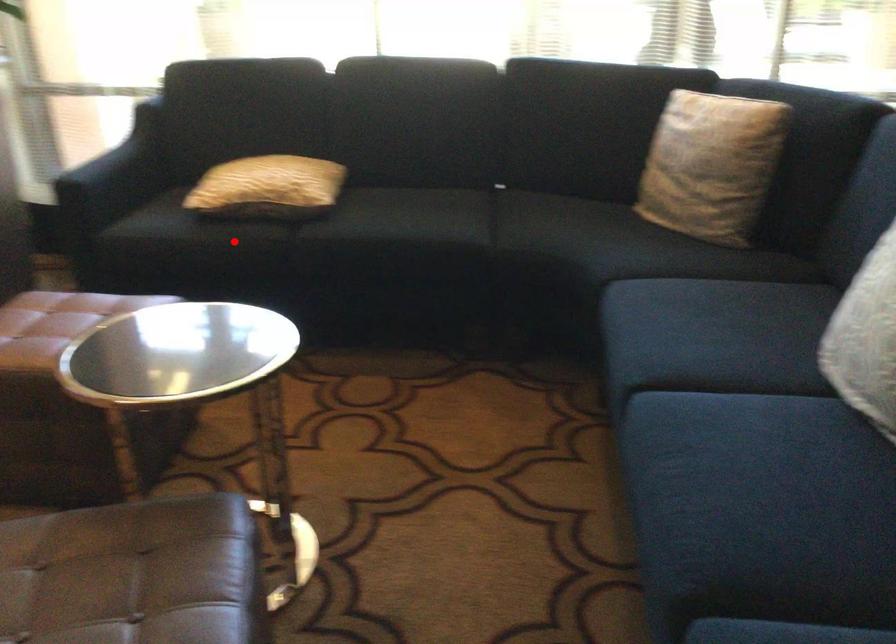
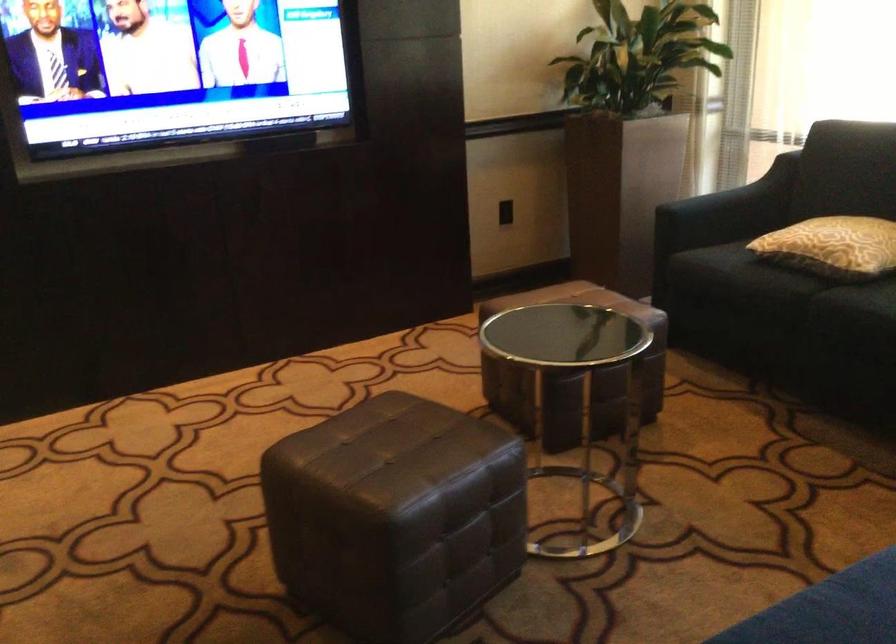
Locate, in the second image, the point that corresponds to the highlighted location in the first image.

(767, 283)